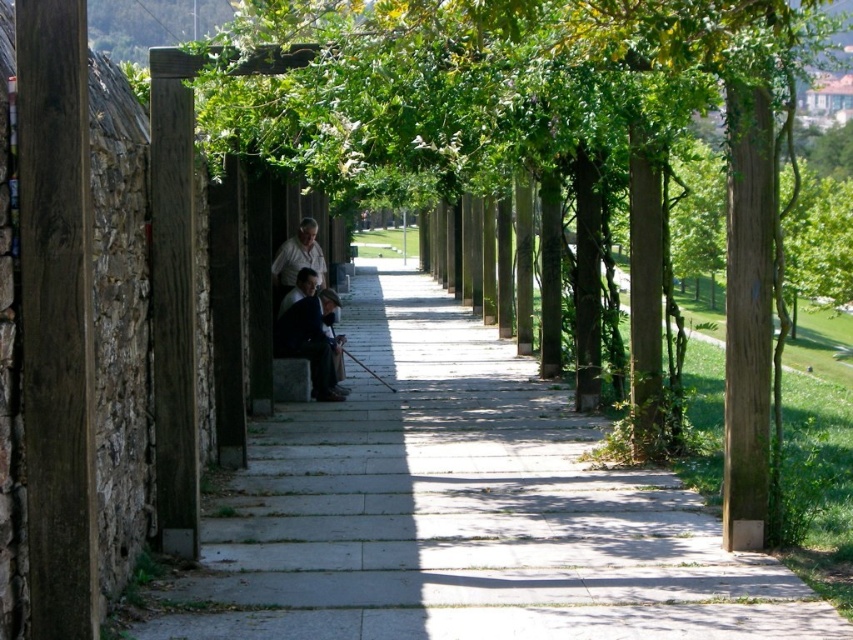
Question: Which point appears closest to the camera in this image?

Choices:
 (A) (283, 280)
 (B) (283, 317)

Answer: (B)

Question: Which point is farther to the camera?

Choices:
 (A) matte black jacket at center
 (B) gray concrete pavement at center

Answer: (A)

Question: Which point is farther to the camera?

Choices:
 (A) (293, 241)
 (B) (296, 339)

Answer: (A)

Question: Does gray concrete pavement at center appear on the left side of matte black jacket at center?

Choices:
 (A) yes
 (B) no

Answer: (B)

Question: Is gray concrete pavement at center closer to the viewer compared to dark gray suit at center?

Choices:
 (A) yes
 (B) no

Answer: (A)

Question: Is dark gray suit at center bigger than matte black jacket at center?

Choices:
 (A) yes
 (B) no

Answer: (B)